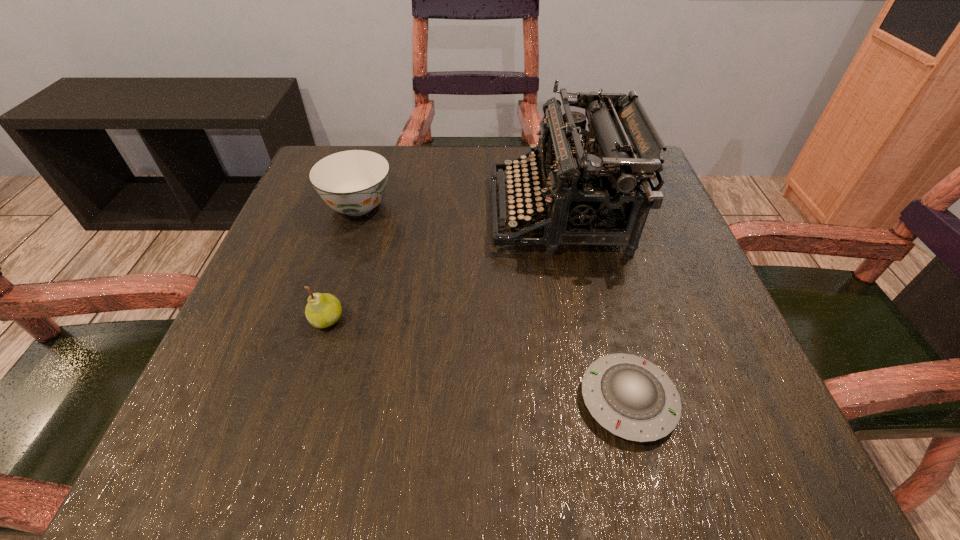
Where is `the tallest object`? the tallest object is located at coordinates (597, 188).

Find the location of a particular element. This screenshot has height=540, width=960. the third farthest object is located at coordinates (322, 310).

Identify the location of soup bowl. Image resolution: width=960 pixels, height=540 pixels. [x=353, y=182].

In order to click on the nearest object in this screenshot , I will do `click(629, 396)`.

Where is `the shortest object`? the shortest object is located at coordinates (629, 396).

Locate an element on the screen. This screenshot has height=540, width=960. vacant space located on the typing side of the typewriter is located at coordinates (319, 212).

At what (x,y) coordinates should I click in order to perform the action: click on free space located on the typing side of the typewriter. Please return your answer as a coordinate pair (x, y). The width and height of the screenshot is (960, 540). Looking at the image, I should click on (468, 212).

Where is `vacant space located 0.240m on the typing side of the typewriter`? The image size is (960, 540). vacant space located 0.240m on the typing side of the typewriter is located at coordinates (376, 212).

Locate an element on the screen. Image resolution: width=960 pixels, height=540 pixels. vacant space located 0.050m on the right of the pear is located at coordinates (374, 320).

The image size is (960, 540). In order to click on vacant region located 0.090m on the front of the soup bowl in this screenshot , I will do `click(341, 261)`.